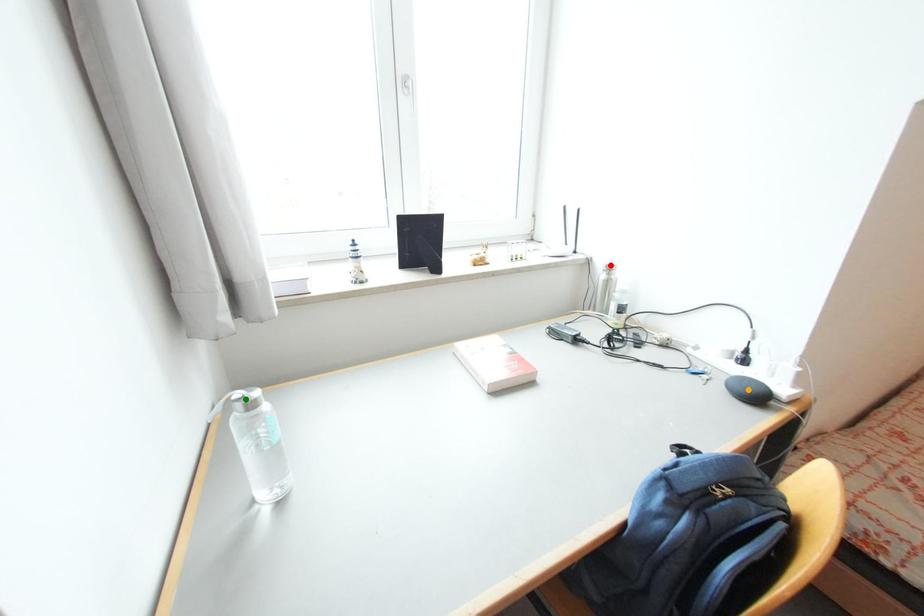
Order these from nearest to farthest:
red point, green point, orange point

green point
orange point
red point